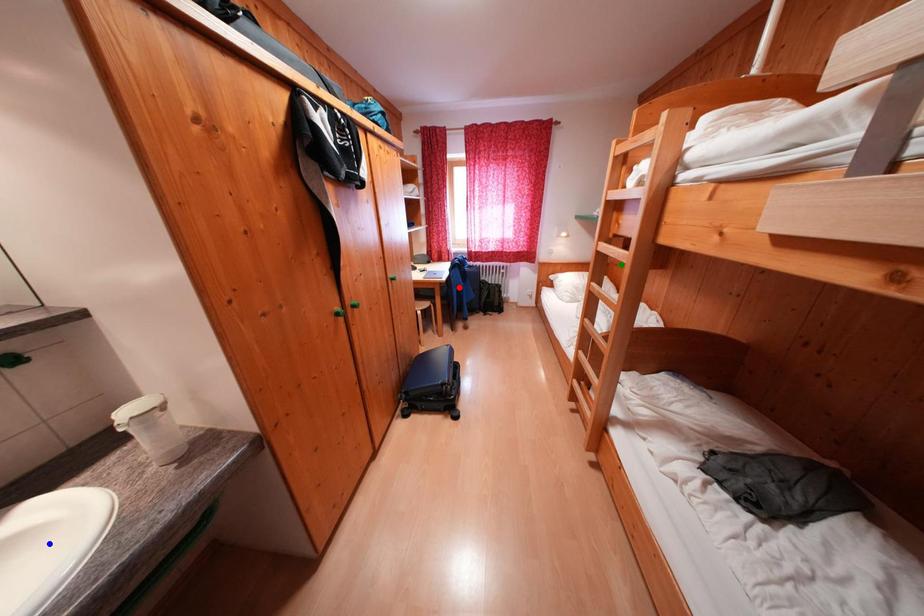
Order these from farthest to nearest:
green point | red point | blue point

1. red point
2. green point
3. blue point